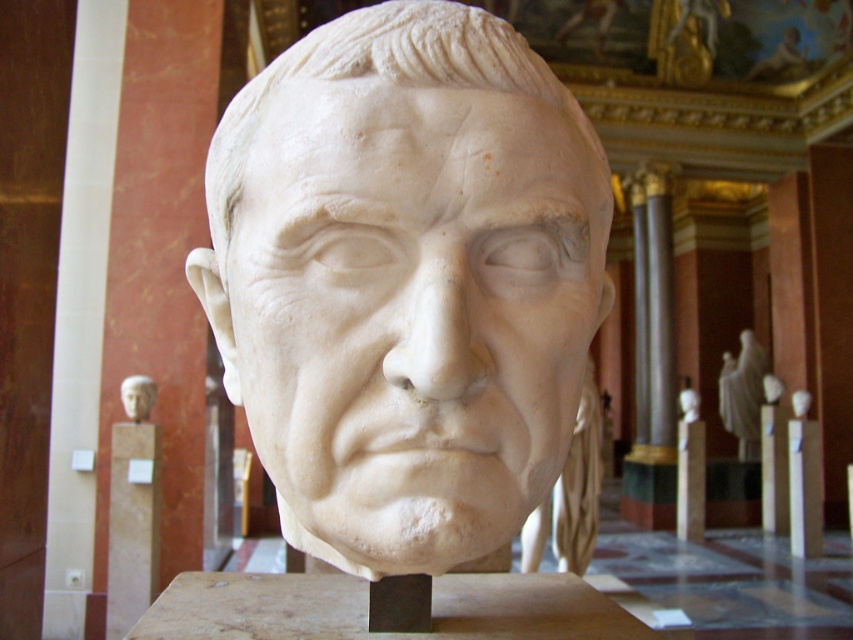
You are an art student visiting a museum. You see the white marble bust at center and the white marble statue at center. Which one is shorter?

The white marble bust at center is shorter than the white marble statue at center.

You are standing in a museum and want to locate the white marble statue at center. According to the coordinates provided, where should you look relative to the entrance?

The white marble statue at center is located at coordinates point (743, 394). Since coordinate systems typically place the origin at the bottom left corner, the statue is positioned to the right and above the entrance.